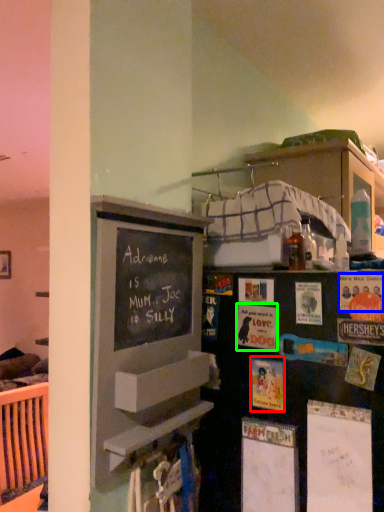
Question: Which is farther away from postcard (highlighted by a red box)? postcard (highlighted by a blue box) or postcard (highlighted by a green box)?

Choices:
 (A) postcard
 (B) postcard

Answer: (A)